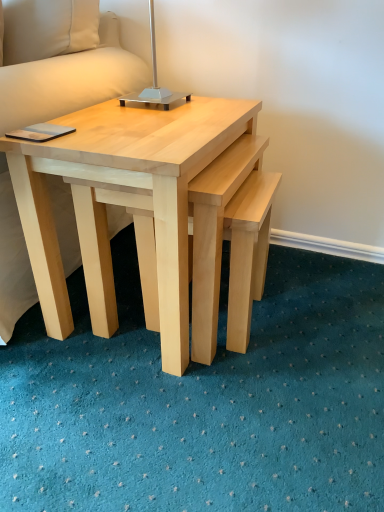
Find the location of `unoccupied region to the right of metallic silver table lamp at upper center`. unoccupied region to the right of metallic silver table lamp at upper center is located at coordinates (223, 109).